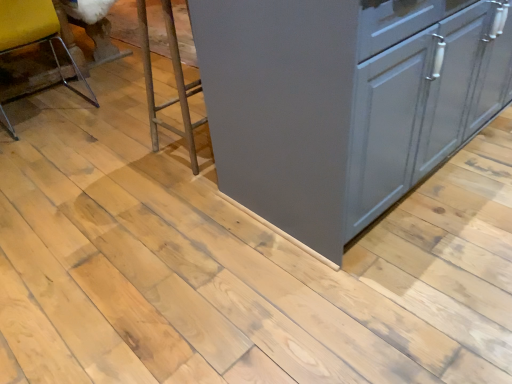
Identify the location of vacant space behind clear plastic chair at left. (78, 82).